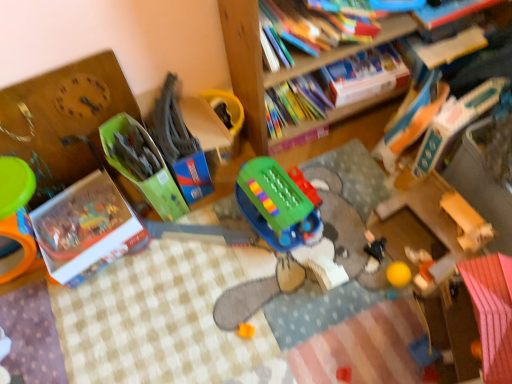
Identify the location of wooden bookcase at upper center. This screenshot has width=512, height=384. (290, 74).

How much space does hardcover book at upper center, placed as the third book when sorted from left to right, occupy vertically?

hardcover book at upper center, placed as the third book when sorted from left to right, is 8.09 centimeters tall.

Find the location of a particular element. Image resolution: width=512 pixels, height=384 pixels. hardcover book at upper center, which is the third book in right-to-left order is located at coordinates (365, 75).

In the scene shown: How much space does green plastic toy at center, which ranks as the 2th toy in left-to-right order, occupy vertically?

green plastic toy at center, which ranks as the 2th toy in left-to-right order, is 14.07 inches tall.

Measure the distance between green plastic toy at center, the 5th toy positioned from the right, and camera.

4.18 feet.

What is the approximate height of green plastic toy at center, positioned as the third toy in right-to-left order?

It is 6.02 inches.

Describe the element at coordinates (276, 206) in the screenshot. I see `green plastic toy at center, the fourth toy when ordered from left to right` at that location.

The image size is (512, 384). Describe the element at coordinates (449, 11) in the screenshot. I see `hardcover book at upper right, which is the fourth book in left-to-right order` at that location.

Where is `wooden bookcase at upper center`? The image size is (512, 384). wooden bookcase at upper center is located at coordinates (290, 74).

In the scene shown: From the image's perspective, is wooden bookcase at upper center on hardcover book at upper right, the 5th book when ordered from left to right?

Correct, wooden bookcase at upper center appears higher than hardcover book at upper right, the 5th book when ordered from left to right, in the image.

Is the surface of wooden bookcase at upper center in direct contact with hardcover book at upper right, the 5th book when ordered from left to right?

No, wooden bookcase at upper center is not in contact with hardcover book at upper right, the 5th book when ordered from left to right.

Is wooden bookcase at upper center facing away from hardcover book at upper right, the 5th book when ordered from left to right?

wooden bookcase at upper center is not turned away from hardcover book at upper right, the 5th book when ordered from left to right.

Based on their positions, is wooden bookcase at upper center located to the left or right of rubberized orange ball at lower right, which is the first toy in right-to-left order?

Based on their positions, wooden bookcase at upper center is located to the left of rubberized orange ball at lower right, which is the first toy in right-to-left order.

Based on their sizes in the image, would you say wooden bookcase at upper center is bigger or smaller than rubberized orange ball at lower right, which is the first toy in right-to-left order?

In the image, wooden bookcase at upper center appears to be larger than rubberized orange ball at lower right, which is the first toy in right-to-left order.

From a real-world perspective, is wooden bookcase at upper center above or below rubberized orange ball at lower right, which is the first toy in right-to-left order?

wooden bookcase at upper center is situated higher than rubberized orange ball at lower right, which is the first toy in right-to-left order, in the real world.

Considering the relative sizes of wooden bookcase at upper center and rubberized orange ball at lower right, which is the first toy in right-to-left order, in the image provided, is wooden bookcase at upper center wider than rubberized orange ball at lower right, which is the first toy in right-to-left order,?

Correct, the width of wooden bookcase at upper center exceeds that of rubberized orange ball at lower right, which is the first toy in right-to-left order.

Is green plastic toy at center, which ranks as the 2th toy in left-to-right order, smaller than rubberized orange ball at lower right, which is the first toy in right-to-left order?

Incorrect, green plastic toy at center, which ranks as the 2th toy in left-to-right order, is not smaller in size than rubberized orange ball at lower right, which is the first toy in right-to-left order.

Considering the positions of points (168, 138) and (415, 281), is point (168, 138) closer to camera compared to point (415, 281)?

No, it is behind (415, 281).

You are a GUI agent. You are given a task and a screenshot of the screen. Output one action in this format:
    pyautogui.click(x=<x>, y=<y>)
    Task: Click on the 4th toy to the left of the rubberized orange ball at lower right, which is the first toy in right-to-left order, counting from the anchor's position
    The height and width of the screenshot is (384, 512).
    Given the screenshot: What is the action you would take?
    pyautogui.click(x=179, y=144)

Is green plastic toy at center, the 5th toy positioned from the right, wider or thinner than rubberized orange ball at lower right, which is the first toy in right-to-left order?

Considering their sizes, green plastic toy at center, the 5th toy positioned from the right, looks broader than rubberized orange ball at lower right, which is the first toy in right-to-left order.

Is hardcover book at upper right, the second book when ordered from right to left, thinner than green plastic toy at center, which ranks as the 2th toy in left-to-right order?

Incorrect, the width of hardcover book at upper right, the second book when ordered from right to left, is not less than that of green plastic toy at center, which ranks as the 2th toy in left-to-right order.

You are a GUI agent. You are given a task and a screenshot of the screen. Output one action in this format:
    pyautogui.click(x=<x>, y=<y>)
    Task: Click on the 1st toy positioned below the hardcover book at upper right, the second book when ordered from right to left (from a real-world perspective)
    The image size is (512, 384).
    Given the screenshot: What is the action you would take?
    pyautogui.click(x=179, y=144)

Considering the positions of point (430, 21) and point (179, 186), is point (430, 21) closer or farther from the camera than point (179, 186)?

Point (430, 21) appears to be farther away from the viewer than point (179, 186).

Is hardcover book at upper right, which is the fourth book in left-to-right order, closer to camera compared to green plastic toy at center, the 5th toy positioned from the right?

No, hardcover book at upper right, which is the fourth book in left-to-right order, is further to the viewer.

Does hardcover book at upper right, the 5th book when ordered from left to right, lie in front of orange matte cube at center, the 4th toy viewed from the right?

Yes, hardcover book at upper right, the 5th book when ordered from left to right, is closer to the camera.

Considering the sizes of objects hardcover book at upper right, the first book when ordered from right to left, and orange matte cube at center, positioned as the third toy in left-to-right order, in the image provided, who is taller, hardcover book at upper right, the first book when ordered from right to left, or orange matte cube at center, positioned as the third toy in left-to-right order,?

With more height is hardcover book at upper right, the first book when ordered from right to left.

How different are the orientations of hardcover book at upper right, the first book when ordered from right to left, and orange matte cube at center, positioned as the third toy in left-to-right order, in degrees?

They differ by 36.2 degrees in their facing directions.

Considering the sizes of objects hardcover book at upper right, the fourth book positioned from the right, and green plastic toy at center, the fourth toy when ordered from left to right, in the image provided, who is thinner, hardcover book at upper right, the fourth book positioned from the right, or green plastic toy at center, the fourth toy when ordered from left to right,?

Thinner between the two is hardcover book at upper right, the fourth book positioned from the right.

Is green plastic toy at center, the fourth toy when ordered from left to right, inside hardcover book at upper right, the 2th book from the left?

No, hardcover book at upper right, the 2th book from the left, does not contain green plastic toy at center, the fourth toy when ordered from left to right.

Is hardcover book at upper right, the fourth book positioned from the right, shorter than green plastic toy at center, the fourth toy when ordered from left to right?

Correct, hardcover book at upper right, the fourth book positioned from the right, is not as tall as green plastic toy at center, the fourth toy when ordered from left to right.

Image resolution: width=512 pixels, height=384 pixels. In order to click on the 3rd toy behind the hardcover book at upper right, the 2th book from the left in this screenshot , I will do `click(276, 206)`.

Is point (257, 196) positioned in front of point (162, 97)?

Yes.

Considering the relative sizes of green plastic toy at center, the fourth toy when ordered from left to right, and green plastic toy at center, which ranks as the 2th toy in left-to-right order, in the image provided, is green plastic toy at center, the fourth toy when ordered from left to right, shorter than green plastic toy at center, which ranks as the 2th toy in left-to-right order,?

Yes, green plastic toy at center, the fourth toy when ordered from left to right, is shorter than green plastic toy at center, which ranks as the 2th toy in left-to-right order.

From the image's perspective, who appears lower, green plastic toy at center, positioned as the third toy in right-to-left order, or green plastic toy at center, which ranks as the 2th toy in left-to-right order?

green plastic toy at center, positioned as the third toy in right-to-left order.

Is green plastic toy at center, positioned as the third toy in right-to-left order, to the left or to the right of green plastic toy at center, the 5th toy positioned from the right, in the image?

green plastic toy at center, positioned as the third toy in right-to-left order, is positioned on green plastic toy at center, the 5th toy positioned from the right,'s right side.

At what (x,y) coordinates should I click in order to perform the action: click on bookcase positioned vertically above the hardcover book at upper right, the 5th book when ordered from left to right (from a real-world perspective). Please return your answer as a coordinate pair (x, y). Looking at the image, I should click on (290, 74).

This screenshot has width=512, height=384. I want to click on the 2nd toy to the right when counting from the wooden bookcase at upper center, so click(x=422, y=269).

From the image, which object appears to be farther from black plastic toy at center, positioned as the fifth toy in left-to-right order, rubberized orange ball at lower right, which is the first toy in right-to-left order, or hardcover book at upper center, which is the third book in right-to-left order?

Among the two, hardcover book at upper center, which is the third book in right-to-left order, is located further to black plastic toy at center, positioned as the fifth toy in left-to-right order.

Which object lies nearer to the anchor point hardcover book at upper right, the 5th book when ordered from left to right, green plastic toy at center, the fourth toy when ordered from left to right, or hardcover book at upper right, which is the fourth book in left-to-right order?

hardcover book at upper right, which is the fourth book in left-to-right order.

From the image, which object appears to be farther from hardcover book at upper right, the second book when ordered from right to left, green plastic toy at center, the 5th toy positioned from the right, or black plastic toy at center, positioned as the fifth toy in left-to-right order?

green plastic toy at center, the 5th toy positioned from the right, is further to hardcover book at upper right, the second book when ordered from right to left.

Consider the image. Based on their spatial positions, is green cardboard box at center, placed as the 1th toy when sorted from left to right, or hardcover book at upper right, the 2th book from the left, further from hardcover book at upper center, which is the third book in right-to-left order?

green cardboard box at center, placed as the 1th toy when sorted from left to right, is positioned further to the anchor hardcover book at upper center, which is the third book in right-to-left order.

Based on their spatial positions, is hardcover book at upper right, the 2th book from the left, or rubberized orange ball at lower right, acting as the sixth toy starting from the left, further from wooden bookcase at upper center?

rubberized orange ball at lower right, acting as the sixth toy starting from the left.

Looking at the image, which one is located closer to hardcover book at upper right, the 5th book when ordered from left to right, hardcover book at upper center, which is the third book in right-to-left order, or hardcover book at upper right, which is the fourth book in left-to-right order?

Based on the image, hardcover book at upper center, which is the third book in right-to-left order, appears to be nearer to hardcover book at upper right, the 5th book when ordered from left to right.

Estimate the real-world distances between objects in this image. Which object is closer to rubberized orange ball at lower right, which is the first toy in right-to-left order, green cardboard box at center, the sixth toy viewed from the right, or hardcover book at upper right, which is the fourth book in left-to-right order?

hardcover book at upper right, which is the fourth book in left-to-right order, is closer to rubberized orange ball at lower right, which is the first toy in right-to-left order.

Based on their spatial positions, is black plastic toy at center, the 2th toy positioned from the right, or orange matte cube at center, positioned as the third toy in left-to-right order, further from green plastic toy at center, positioned as the third toy in right-to-left order?

orange matte cube at center, positioned as the third toy in left-to-right order, is positioned further to the anchor green plastic toy at center, positioned as the third toy in right-to-left order.

Find the location of a particular element. bookcase between green cardboard box at center, placed as the 1th toy when sorted from left to right, and hardcover book at upper right, the 5th book when ordered from left to right is located at coordinates (290, 74).

The height and width of the screenshot is (384, 512). Find the location of `bookcase located between green cardboard box at center, the sixth toy viewed from the right, and hardcover book at upper center, which is the third book in right-to-left order, in the left-right direction`. bookcase located between green cardboard box at center, the sixth toy viewed from the right, and hardcover book at upper center, which is the third book in right-to-left order, in the left-right direction is located at coordinates (290, 74).

The image size is (512, 384). What are the coordinates of `book that lies between green plastic toy at center, which ranks as the 2th toy in left-to-right order, and orange matte cube at center, the 4th toy viewed from the right, from top to bottom` in the screenshot? It's located at (86, 229).

Find the location of a particular element. Image resolution: width=512 pixels, height=384 pixels. bookcase located between white cardboard book at lower left, positioned as the fifth book in right-to-left order, and rubberized orange ball at lower right, which is the first toy in right-to-left order, in the left-right direction is located at coordinates (290, 74).